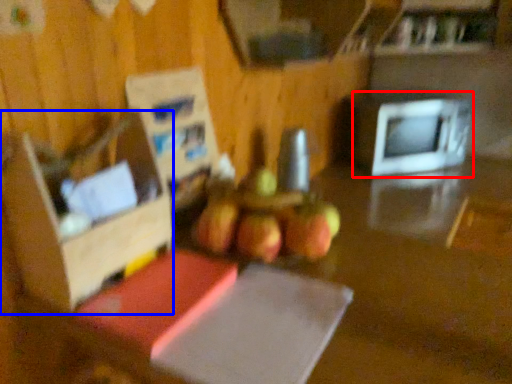
Question: Which object appears closest to the camera in this image, microwave oven (highlighted by a red box) or box (highlighted by a blue box)?

Choices:
 (A) microwave oven
 (B) box

Answer: (B)